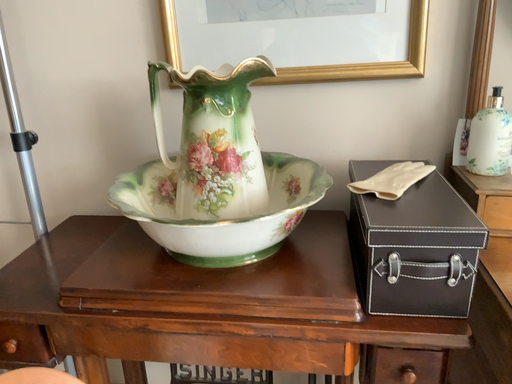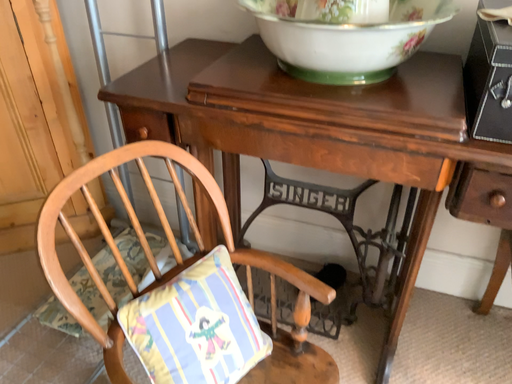
Question: How did the camera likely rotate when shooting the video?

Choices:
 (A) rotated downward
 (B) rotated upward

Answer: (A)